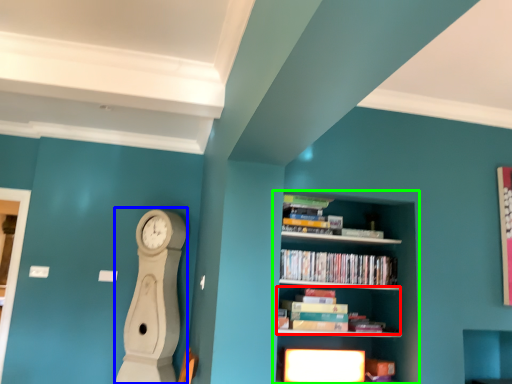
Question: Which object is the farthest from book (highlighted by a red box)? Choose among these: clock (highlighted by a blue box) or shelf (highlighted by a green box).

Choices:
 (A) clock
 (B) shelf

Answer: (A)